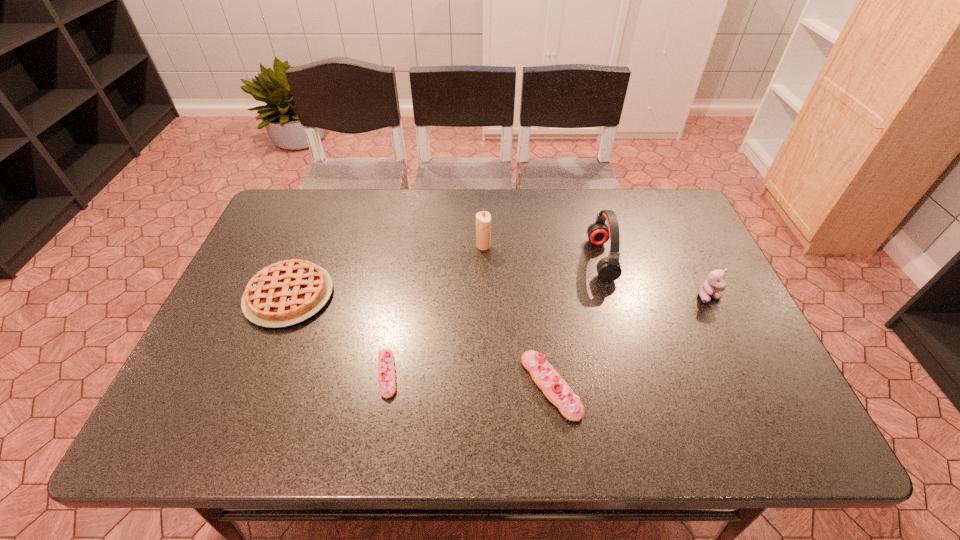
Locate an element on the screen. The height and width of the screenshot is (540, 960). free spot located on the left of the taller eclair is located at coordinates (386, 386).

You are a GUI agent. You are given a task and a screenshot of the screen. Output one action in this format:
    pyautogui.click(x=<x>, y=<y>)
    Task: Click on the vacant space located on the right of the third object from left to right
    This screenshot has width=960, height=540.
    Given the screenshot: What is the action you would take?
    pyautogui.click(x=580, y=246)

In order to click on free space located 0.370m on the right of the pie in this screenshot , I will do `click(474, 296)`.

At what (x,y) coordinates should I click in order to perform the action: click on free spot located at the face of the rightmost object. Please return your answer as a coordinate pair (x, y). Looking at the image, I should click on (755, 393).

You are a GUI agent. You are given a task and a screenshot of the screen. Output one action in this format:
    pyautogui.click(x=<x>, y=<y>)
    Task: Click on the free space located on the ear cups of the second object from right to left
    
    Given the screenshot: What is the action you would take?
    pyautogui.click(x=538, y=259)

This screenshot has width=960, height=540. Find the location of `free spot located on the ear cups of the second object from right to left`. free spot located on the ear cups of the second object from right to left is located at coordinates (510, 259).

You are a GUI agent. You are given a task and a screenshot of the screen. Output one action in this format:
    pyautogui.click(x=<x>, y=<y>)
    Task: Click on the vacant area situated 0.350m on the ear cups of the second object from right to left
    Image resolution: width=960 pixels, height=540 pixels.
    Given the screenshot: What is the action you would take?
    pyautogui.click(x=467, y=259)

In order to click on object that is at the left edge in this screenshot , I will do `click(288, 292)`.

This screenshot has height=540, width=960. Find the location of `object that is at the right edge`. object that is at the right edge is located at coordinates (714, 285).

Where is `free space at the far edge of the desktop`? free space at the far edge of the desktop is located at coordinates (459, 208).